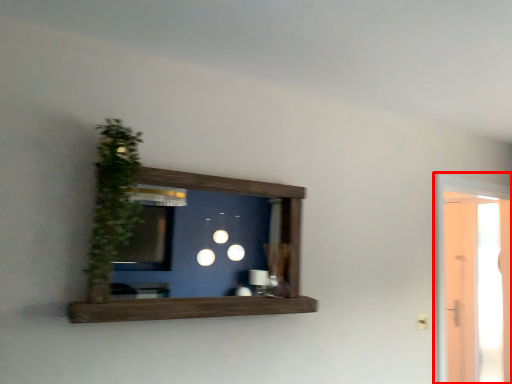
Question: In this image, where is glass door (annotated by the red box) located relative to plant?

Choices:
 (A) right
 (B) left

Answer: (A)